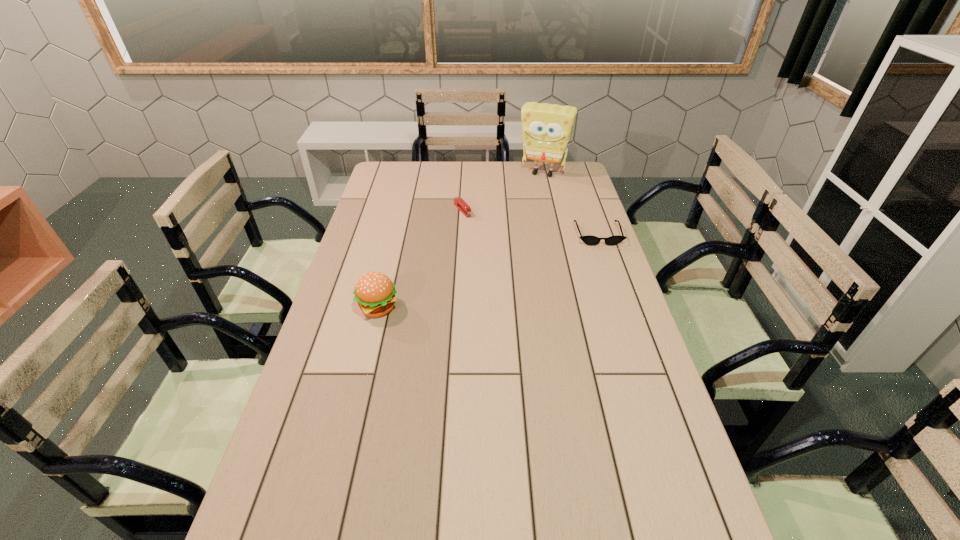
Locate an element on the screen. hamburger is located at coordinates (375, 293).

Where is `the nearest object`? The width and height of the screenshot is (960, 540). the nearest object is located at coordinates (375, 293).

Where is `sunglasses`? The image size is (960, 540). sunglasses is located at coordinates (590, 240).

Identify the location of sponge. (547, 128).

This screenshot has height=540, width=960. I want to click on the farthest object, so click(547, 128).

This screenshot has width=960, height=540. I want to click on the second farthest object, so click(x=458, y=201).

The image size is (960, 540). I want to click on stapler, so click(x=458, y=201).

Find the location of a particular element. blank space located on the front of the hamburger is located at coordinates (359, 383).

Identify the location of free space located 0.070m on the front-facing side of the second nearest object. The height and width of the screenshot is (540, 960). (606, 258).

Locate an element on the screen. vacant space located on the face of the sponge is located at coordinates (516, 227).